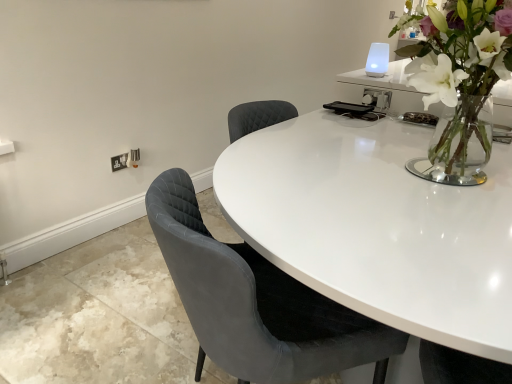
Question: Does point (417, 165) appear closer or farther from the camera than point (153, 203)?

Choices:
 (A) farther
 (B) closer

Answer: (A)

Question: From the image's perspective, is clear glass vase at upper right positioned above or below velvet grey chair at center?

Choices:
 (A) above
 (B) below

Answer: (A)

Question: Based on their relative distances, which object is farther from the clear glass vase at upper right?

Choices:
 (A) velvet grey chair at center
 (B) white plastic electric outlet at lower left

Answer: (B)

Question: Which object is the farthest from the white plastic electric outlet at lower left?

Choices:
 (A) clear glass vase at upper right
 (B) velvet grey chair at center

Answer: (A)